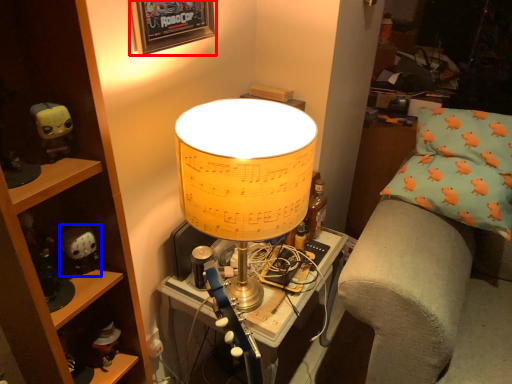
Question: Which object appears closest to the camera in this image, picture frame (highlighted by a red box) or toy (highlighted by a blue box)?

Choices:
 (A) picture frame
 (B) toy

Answer: (A)